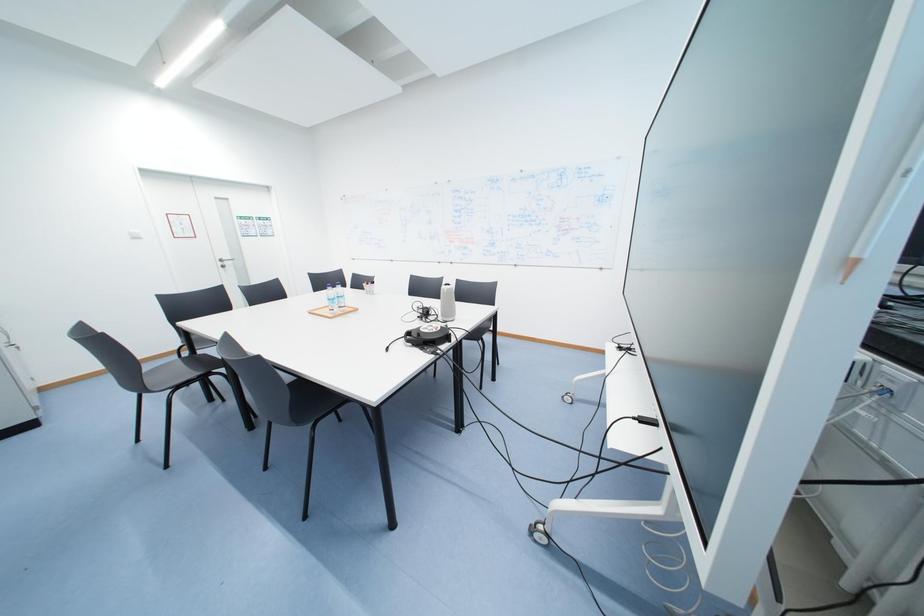
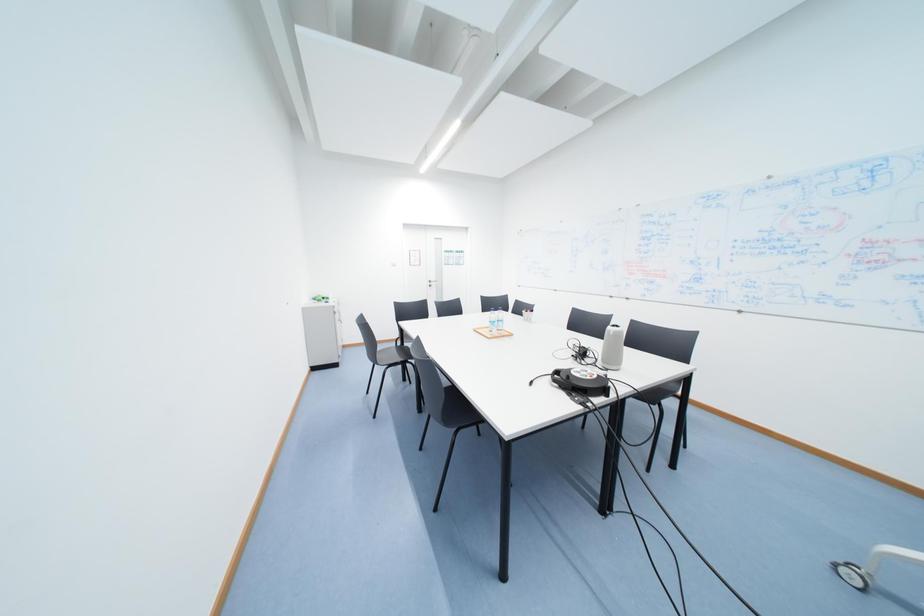
Question: The camera is either moving clockwise (left) or counter-clockwise (right) around the object. The first image is from the beginning of the video and the second image is from the end. Is the camera moving left or right when shooting the video?

Choices:
 (A) Left
 (B) Right

Answer: (B)